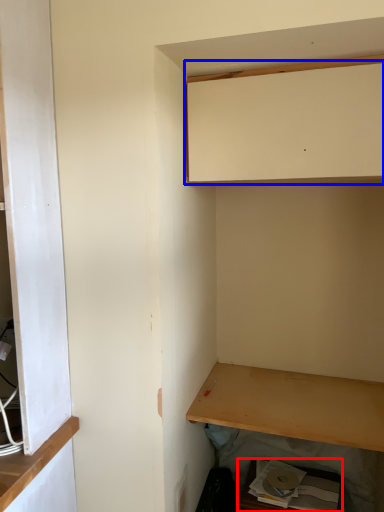
Question: Which object appears farthest to the camera in this image, cabinetry (highlighted by a red box) or cabinetry (highlighted by a blue box)?

Choices:
 (A) cabinetry
 (B) cabinetry

Answer: (A)